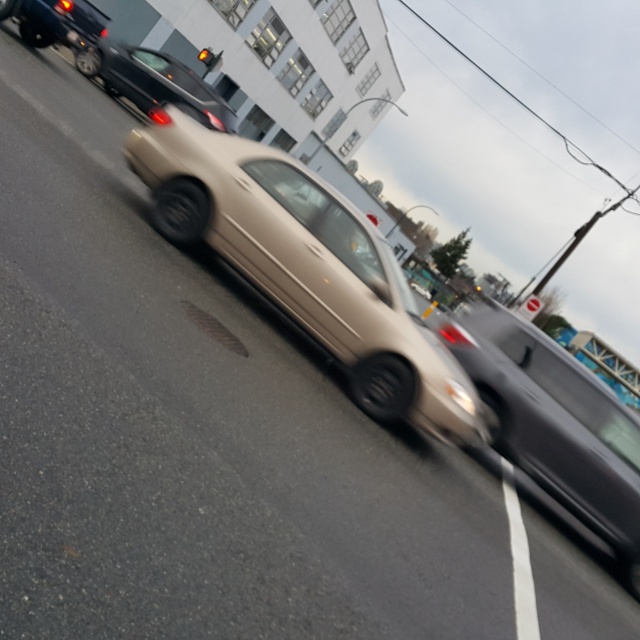
You are a pedestrian standing on the sidewalk and see both the shiny black sedan at upper center and the shiny black car at upper left. Which car is closer to you?

The shiny black sedan at upper center is closer to you because it is located below the shiny black car at upper left, indicating it is positioned lower in the visual field and thus nearer.